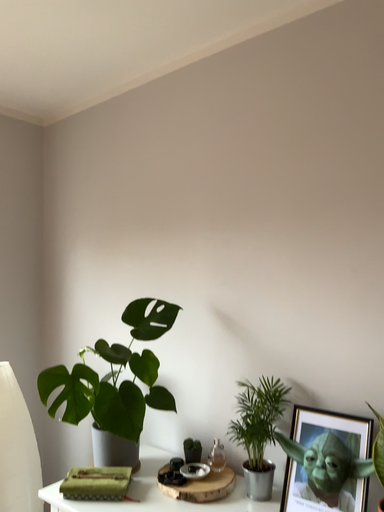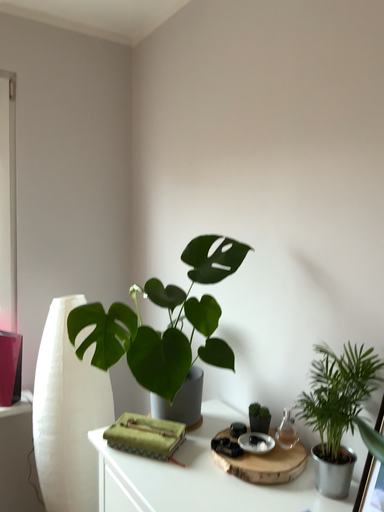
Question: How did the camera likely rotate when shooting the video?

Choices:
 (A) rotated right
 (B) rotated left

Answer: (B)